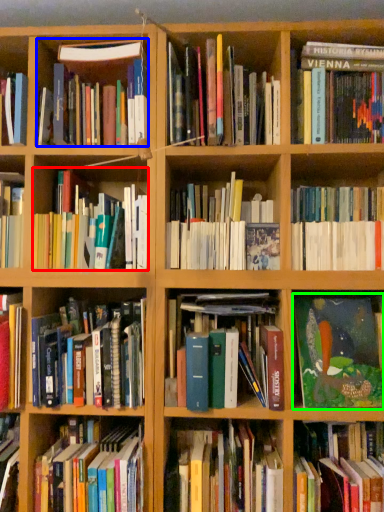
Question: Which is farther away from book (highlighted by a red box)? book (highlighted by a blue box) or book (highlighted by a green box)?

Choices:
 (A) book
 (B) book

Answer: (B)